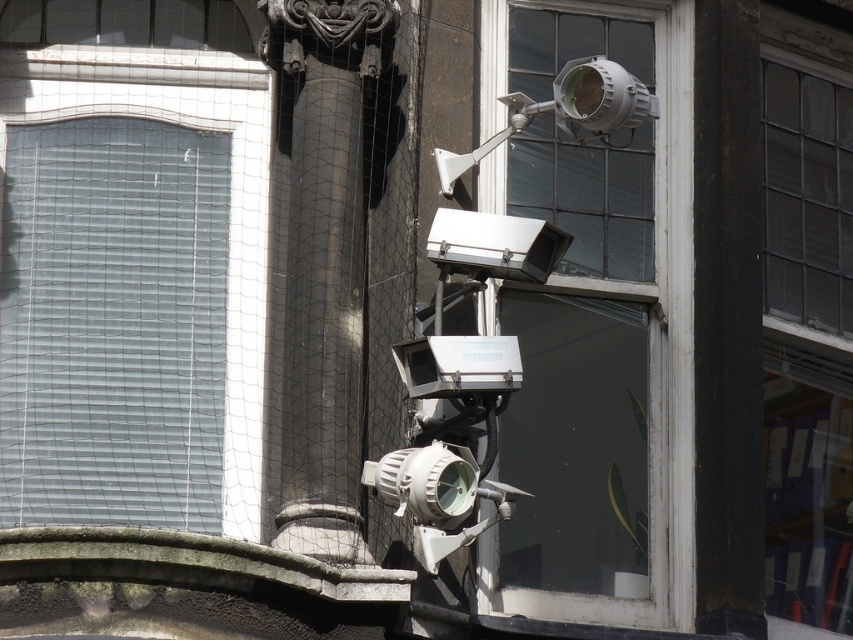
Based on the photo, you are a security technician inspecting the building exterior. You need to determine which of the two points, point [596,486] or point [538,113], is closer to the security camera lens. Based on the coordinates provided, which point is nearer to the camera?

Point [538,113] is closer to the security camera lens because it is positioned closer to the camera than point [596,486].

You are a maintenance worker needing to reach both the clear glass window at center and the matte white security camera at upper center. The ladder you have is 4.5 meters long. Can you safely reach both objects with the ladder you have?

The distance between the clear glass window at center and the matte white security camera at upper center is 5.09 meters. Since the ladder is only 4.5 meters long, it is not long enough to safely reach both objects simultaneously.

You are a technician inspecting the security cameras mounted on the pole. You need to replace the white plastic video camera at center and the matte white security camera at upper center. Which camera should you adjust first if you want to start with the one closer to the window?

The white plastic video camera at center is positioned on the left side of the matte white security camera at upper center. Since the window is mentioned in the scene description, and the cameras are on a pole near the window, the white plastic video camera at center is likely closer to the window as it is to the left of the other camera. Therefore, you should adjust the white plastic video camera at center first.